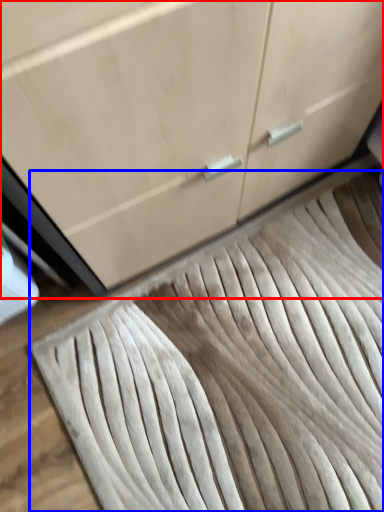
Question: Which of the following is the farthest to the observer, cabinetry (highlighted by a red box) or doormat (highlighted by a blue box)?

Choices:
 (A) cabinetry
 (B) doormat

Answer: (B)